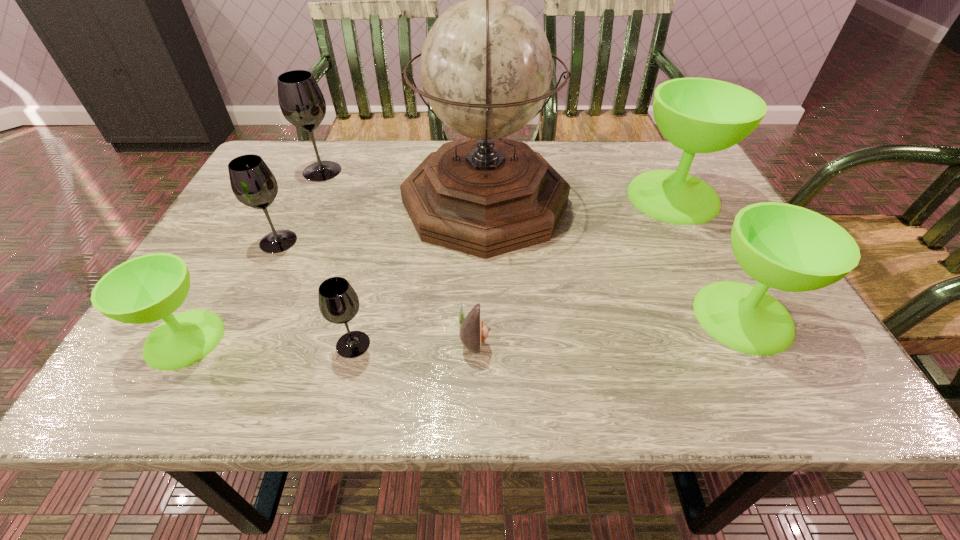
The width and height of the screenshot is (960, 540). I want to click on the second closest wineglass to the second smallest green wineglass, so click(338, 302).

Point out which wineglass is positioned as the second nearest to the second smallest green wineglass. Please provide its 2D coordinates. Your answer should be formatted as a tuple, i.e. [(x, y)], where the tuple contains the x and y coordinates of a point satisfying the conditions above.

[(338, 302)]

Locate which gray wineglass is the closest to the fourth nearest wineglass. Please provide its 2D coordinates. Your answer should be formatted as a tuple, i.e. [(x, y)], where the tuple contains the x and y coordinates of a point satisfying the conditions above.

[(301, 101)]

Identify the location of gray wineglass that stands as the second closest to the second smallest gray wineglass. Image resolution: width=960 pixels, height=540 pixels. (338, 302).

This screenshot has height=540, width=960. Find the location of `the second closest green wineglass relative to the biggest green wineglass`. the second closest green wineglass relative to the biggest green wineglass is located at coordinates (145, 289).

Where is `the second closest green wineglass to the rightmost gray wineglass`? the second closest green wineglass to the rightmost gray wineglass is located at coordinates (786, 247).

This screenshot has height=540, width=960. I want to click on vacant space that satisfies the following two spatial constraints: 1. on the front side of the fifth object from right to left; 2. on the right side of the second smallest gray wineglass, so click(229, 345).

Find the location of a particular element. free spot that satisfies the following two spatial constraints: 1. on the front side of the second biggest green wineglass; 2. on the left side of the second farthest gray wineglass is located at coordinates (242, 316).

Locate an element on the screen. This screenshot has height=540, width=960. vacant area in the image that satisfies the following two spatial constraints: 1. on the surface of the second biggest green wineglass; 2. on the right side of the tallest object is located at coordinates (487, 316).

Where is `vacant point that satisfies the following two spatial constraints: 1. on the back side of the leftmost green wineglass; 2. on the right side of the second biggest green wineglass`? This screenshot has height=540, width=960. vacant point that satisfies the following two spatial constraints: 1. on the back side of the leftmost green wineglass; 2. on the right side of the second biggest green wineglass is located at coordinates (198, 316).